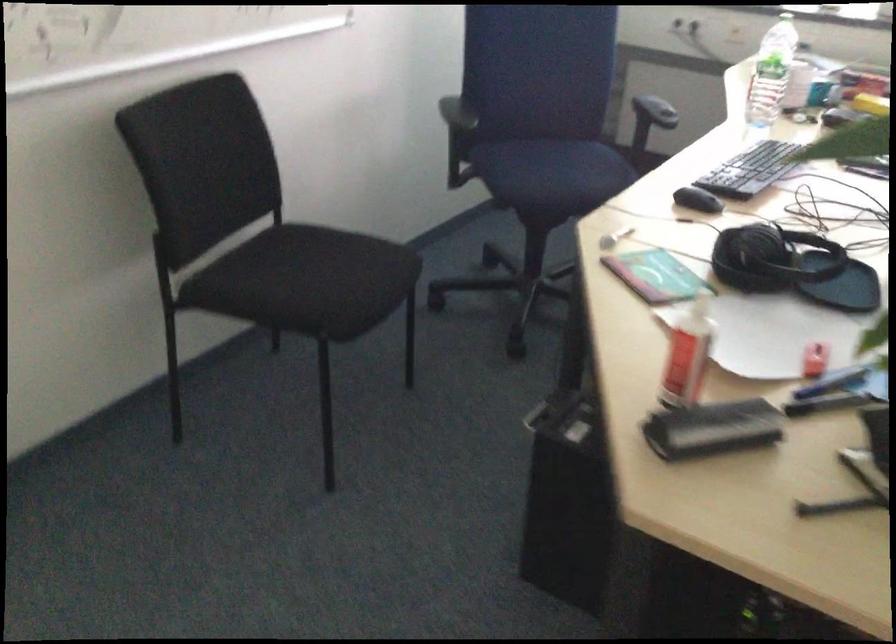
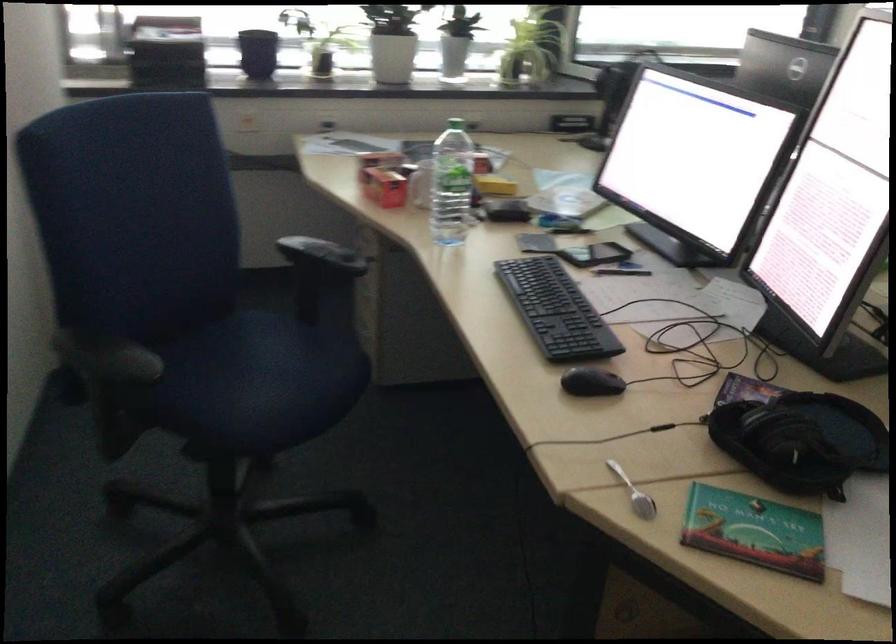
Locate, in the second image, the point that corresponds to the point at 547,155 in the first image.

(245, 365)